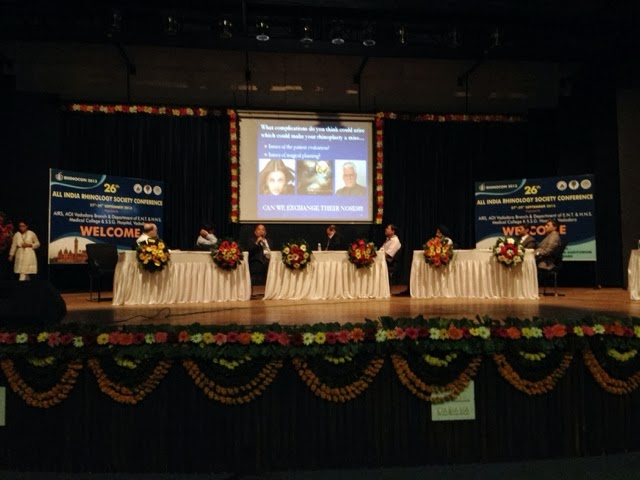
Find the location of `table wreath`. table wreath is located at coordinates (509, 253), (428, 252), (365, 251), (299, 259), (232, 256), (152, 255).